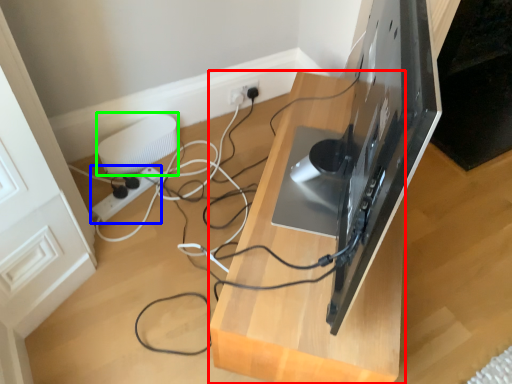
Question: Based on their relative distances, which object is farther from furniture (highlighted by a red box)? Choose from extension cord (highlighted by a blue box) and appliance (highlighted by a green box).

Choices:
 (A) extension cord
 (B) appliance

Answer: (A)